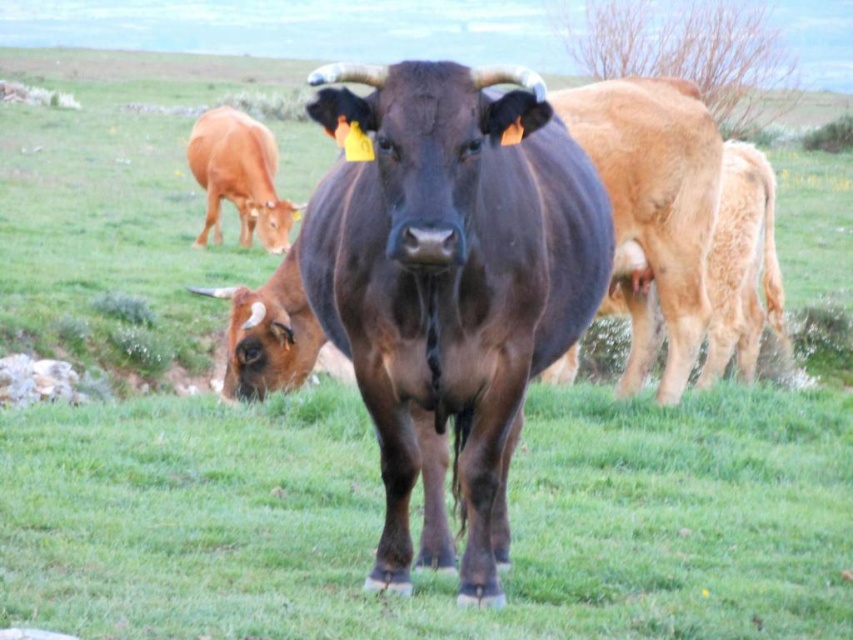
Question: Which point is closer to the camera taking this photo?

Choices:
 (A) (495, 113)
 (B) (229, 346)
 (C) (241, 188)

Answer: (A)

Question: Estimate the real-world distances between objects in this image. Which object is closer to the brown glossy cow at lower left?

Choices:
 (A) shiny brown bull at center
 (B) brown glossy cow at left

Answer: (A)

Question: Is shiny brown bull at center to the right of brown glossy cow at lower left from the viewer's perspective?

Choices:
 (A) no
 (B) yes

Answer: (B)

Question: Is brown glossy cow at lower left wider than brown glossy cow at left?

Choices:
 (A) yes
 (B) no

Answer: (A)

Question: Estimate the real-world distances between objects in this image. Which object is closer to the brown glossy cow at left?

Choices:
 (A) brown glossy cow at lower left
 (B) shiny brown bull at center

Answer: (A)

Question: Is shiny brown bull at center smaller than brown glossy cow at lower left?

Choices:
 (A) no
 (B) yes

Answer: (A)